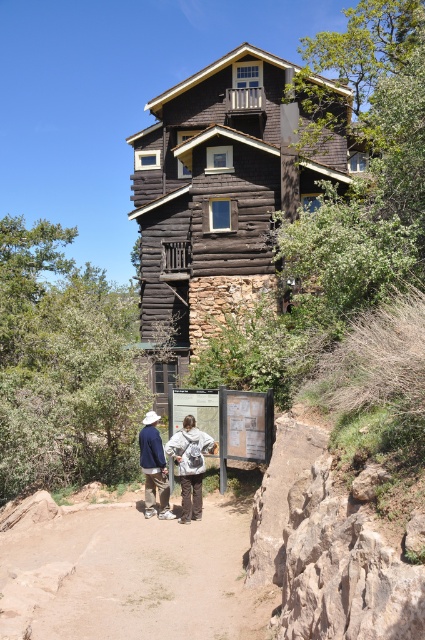
Question: Considering the real-world distances, which object is farthest from the khaki cotton pants at center?

Choices:
 (A) dark brown wood log cabin at center
 (B) brown dirt path at lower center

Answer: (A)

Question: Is dark brown wood log cabin at center wider than khaki cotton pants at center?

Choices:
 (A) yes
 (B) no

Answer: (A)

Question: Does dark brown wood log cabin at center appear on the right side of matte brown pants at lower center?

Choices:
 (A) yes
 (B) no

Answer: (A)

Question: Which of the following is the farthest from the observer?

Choices:
 (A) (181, 436)
 (B) (240, 294)
 (C) (278, 592)

Answer: (B)

Question: From the image, what is the correct spatial relationship of dark brown wood log cabin at center in relation to khaki cotton pants at center?

Choices:
 (A) right
 (B) left

Answer: (A)

Question: Which object is the closest to the dark brown wood log cabin at center?

Choices:
 (A) brown dirt path at lower center
 (B) khaki cotton pants at center
 (C) matte brown pants at lower center

Answer: (B)